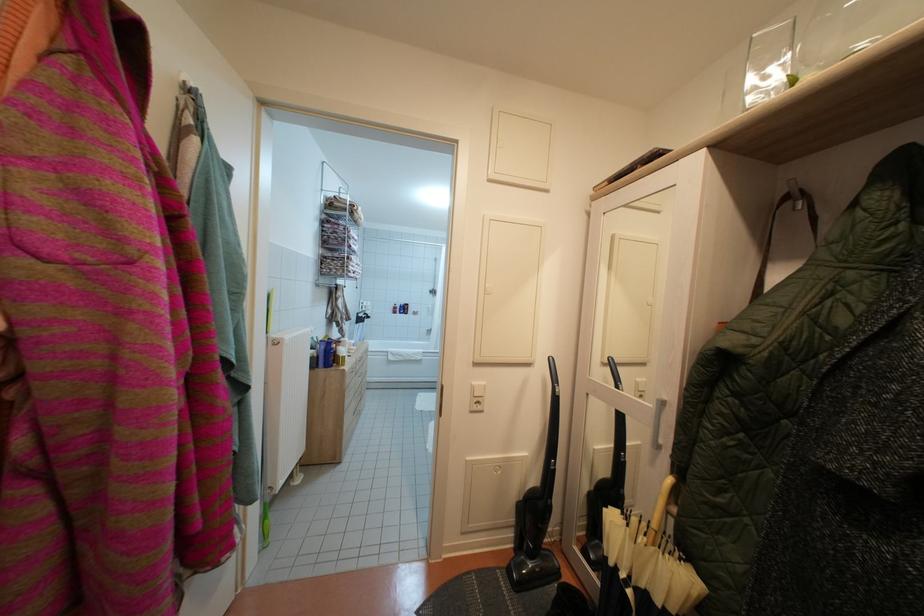
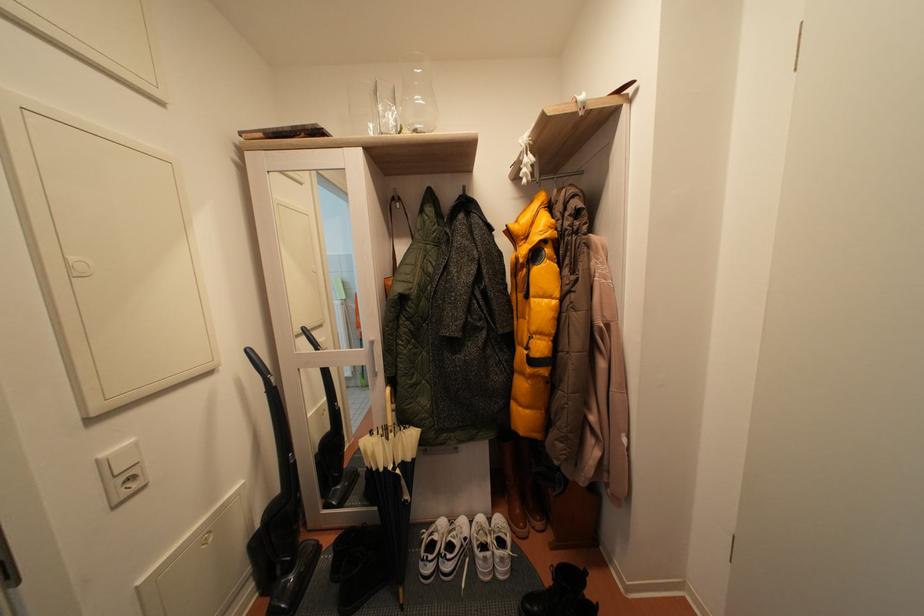
Where in the second image is the point corresponding to point (480, 389) from the first image?

(111, 460)